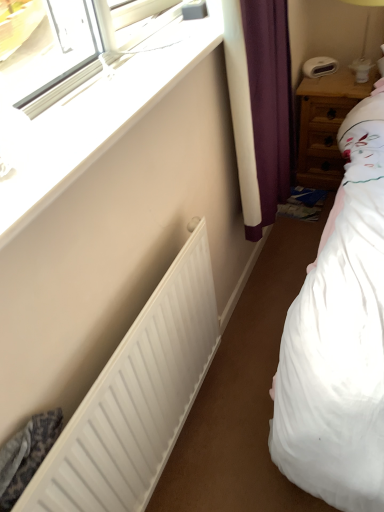
You are a GUI agent. You are given a task and a screenshot of the screen. Output one action in this format:
    pyautogui.click(x=<x>, y=<y>)
    Task: Click on the free spot below white matte radiator at lower left (from a real-world perspective)
    The height and width of the screenshot is (512, 384).
    Given the screenshot: What is the action you would take?
    pyautogui.click(x=187, y=432)